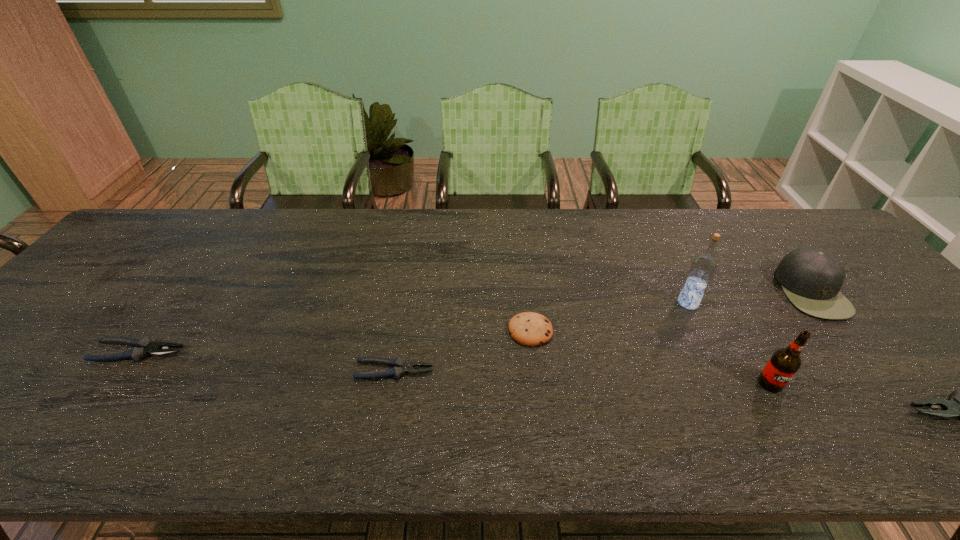
The width and height of the screenshot is (960, 540). I want to click on object that is at the right edge, so click(x=811, y=278).

Where is `free space at the far edge of the desktop`? free space at the far edge of the desktop is located at coordinates (319, 237).

Identify the location of blank space at the near edge of the desktop. The height and width of the screenshot is (540, 960). (449, 408).

The height and width of the screenshot is (540, 960). I want to click on blank area at the left edge, so click(62, 343).

Locate an element on the screen. vacant space at the right edge of the desktop is located at coordinates (908, 354).

Locate an element on the screen. This screenshot has width=960, height=540. free spot at the far left corner of the desktop is located at coordinates (149, 220).

Where is `vacant space in between the second shortest pliers and the fifth object from right to left`? Image resolution: width=960 pixels, height=540 pixels. vacant space in between the second shortest pliers and the fifth object from right to left is located at coordinates (335, 341).

At what (x,y) coordinates should I click in order to perform the action: click on free point between the second tallest object and the second shortest pliers. Please return your answer as a coordinate pair (x, y). The image size is (960, 540). Looking at the image, I should click on (455, 368).

Where is `free point between the third object from left to right and the vodka`? This screenshot has height=540, width=960. free point between the third object from left to right and the vodka is located at coordinates (610, 317).

At what (x,y) coordinates should I click in order to perform the action: click on free space between the third object from right to left and the fourth object from left to right. Please return your answer as a coordinate pair (x, y). Looking at the image, I should click on (729, 343).